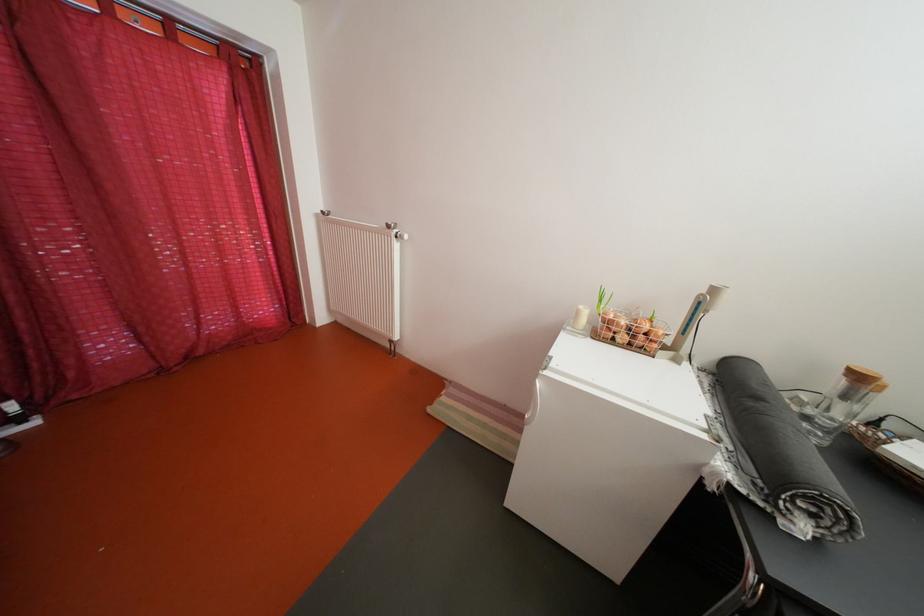
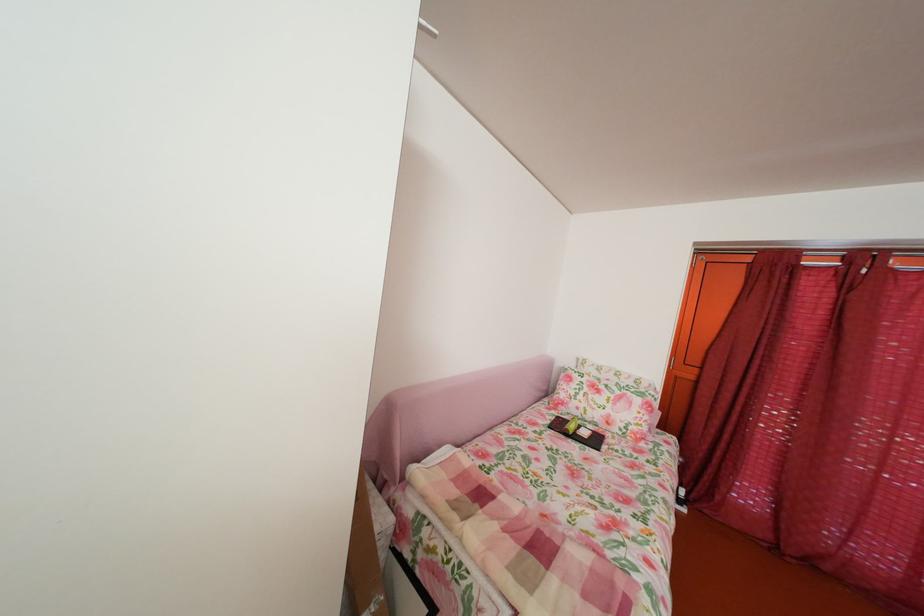
Question: The camera is either moving clockwise (left) or counter-clockwise (right) around the object. The first image is from the beginning of the video and the second image is from the end. Is the camera moving left or right when shooting the video?

Choices:
 (A) Left
 (B) Right

Answer: (B)